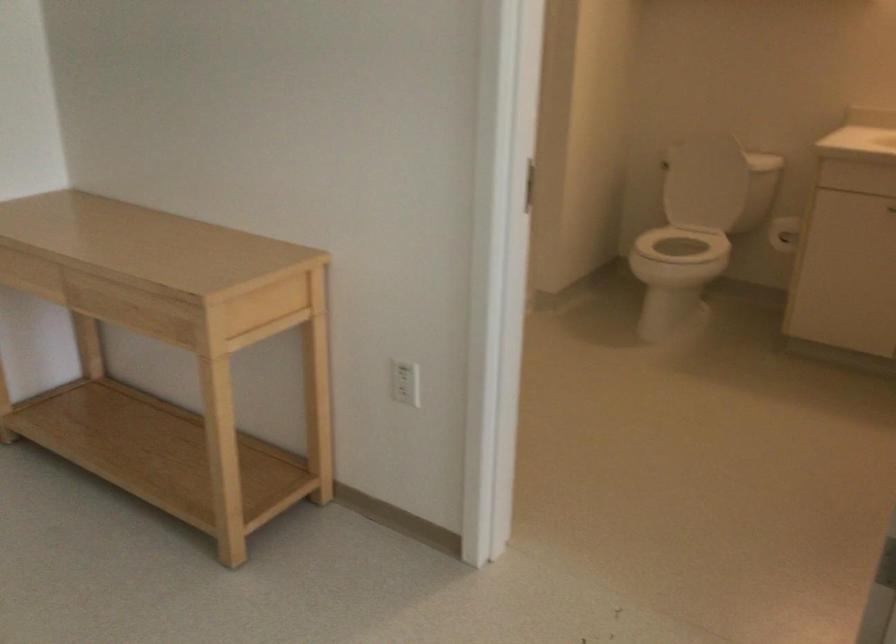
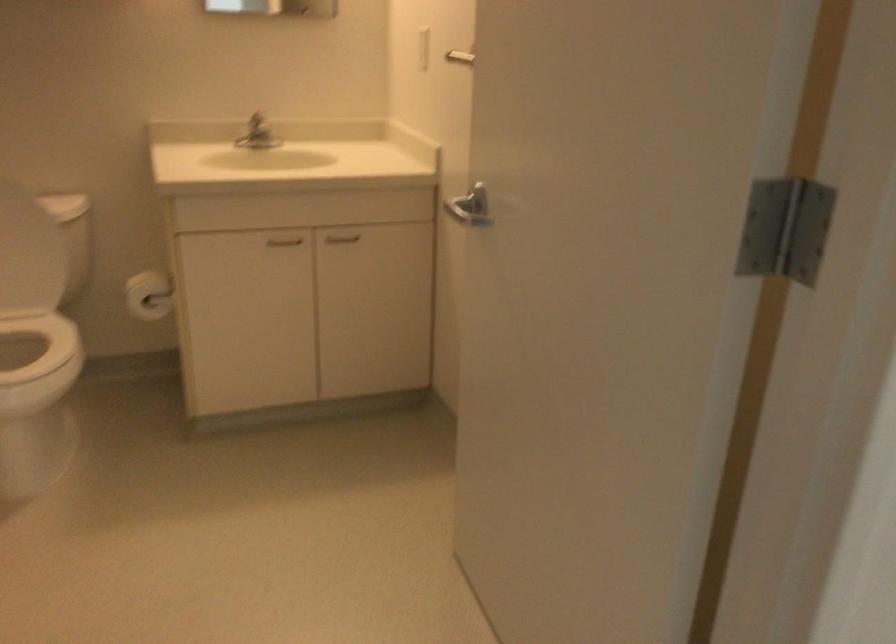
Where in the second image is the point corresponding to [726,153] from the first image?

(12, 210)